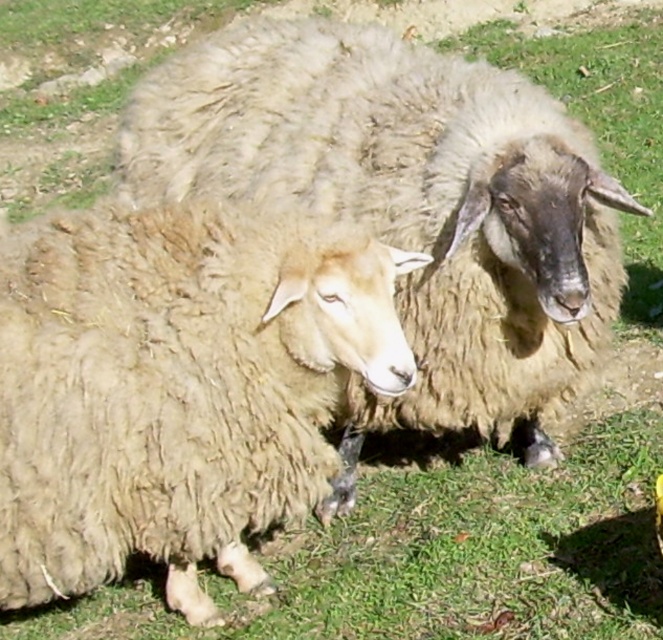
Question: Observing the image, what is the correct spatial positioning of fuzzy beige wool at center in reference to fuzzy woolen sheep at center?

Choices:
 (A) left
 (B) right

Answer: (A)

Question: Which point appears farthest from the camera in this image?

Choices:
 (A) (139, 516)
 (B) (455, 198)

Answer: (B)

Question: From the image, what is the correct spatial relationship of fuzzy beige wool at center in relation to fuzzy woolen sheep at center?

Choices:
 (A) right
 (B) left

Answer: (B)

Question: Is fuzzy beige wool at center positioned before fuzzy woolen sheep at center?

Choices:
 (A) no
 (B) yes

Answer: (B)

Question: Which point is closer to the camera?

Choices:
 (A) (414, 336)
 (B) (70, 435)

Answer: (B)

Question: Which object is farther from the camera taking this photo?

Choices:
 (A) fuzzy woolen sheep at center
 (B) fuzzy beige wool at center

Answer: (A)